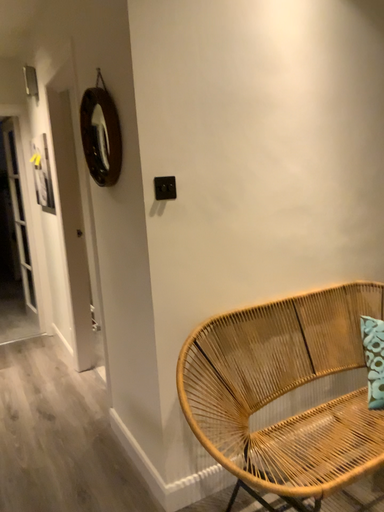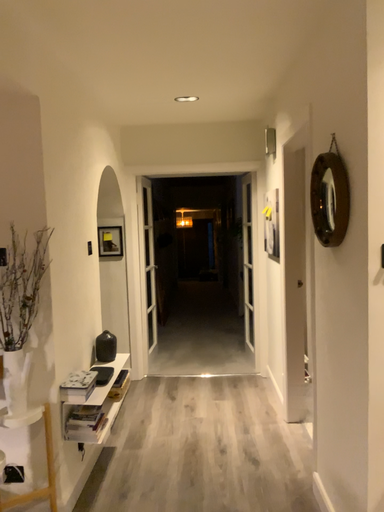
Question: How did the camera likely rotate when shooting the video?

Choices:
 (A) rotated upward
 (B) rotated downward

Answer: (A)